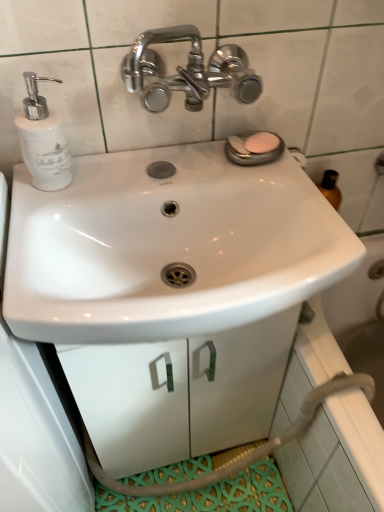
Question: Should I look upward or downward to see white matte cabinet at center?

Choices:
 (A) down
 (B) up

Answer: (A)

Question: Can you confirm if pink matte soap at upper right is positioned to the right of white glossy sink at center?

Choices:
 (A) yes
 (B) no

Answer: (A)

Question: Considering the relative sizes of pink matte soap at upper right and white glossy sink at center in the image provided, is pink matte soap at upper right wider than white glossy sink at center?

Choices:
 (A) no
 (B) yes

Answer: (A)

Question: Does pink matte soap at upper right have a greater height compared to white glossy sink at center?

Choices:
 (A) no
 (B) yes

Answer: (A)

Question: Is white glossy sink at center completely or partially inside pink matte soap at upper right?

Choices:
 (A) yes
 (B) no

Answer: (B)

Question: Is pink matte soap at upper right looking in the opposite direction of white glossy sink at center?

Choices:
 (A) yes
 (B) no

Answer: (B)

Question: Is pink matte soap at upper right thinner than white glossy sink at center?

Choices:
 (A) yes
 (B) no

Answer: (A)

Question: Are white glossy soap dispenser at left and pink matte soap at upper right beside each other?

Choices:
 (A) yes
 (B) no

Answer: (B)

Question: Does white glossy soap dispenser at left have a larger size compared to pink matte soap at upper right?

Choices:
 (A) yes
 (B) no

Answer: (A)

Question: Does white glossy soap dispenser at left appear on the left side of pink matte soap at upper right?

Choices:
 (A) no
 (B) yes

Answer: (B)

Question: Is white glossy soap dispenser at left positioned beyond the bounds of pink matte soap at upper right?

Choices:
 (A) yes
 (B) no

Answer: (A)

Question: Can you confirm if white glossy soap dispenser at left is shorter than pink matte soap at upper right?

Choices:
 (A) yes
 (B) no

Answer: (B)

Question: Is white glossy soap dispenser at left surrounding pink matte soap at upper right?

Choices:
 (A) yes
 (B) no

Answer: (B)

Question: Is pink matte soap at upper right aimed at white glossy soap dispenser at left?

Choices:
 (A) yes
 (B) no

Answer: (B)